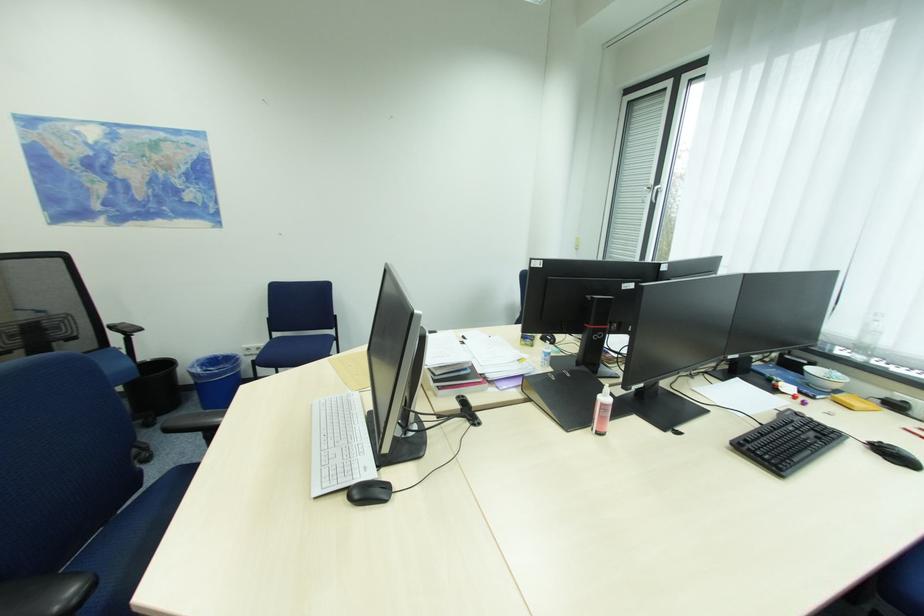
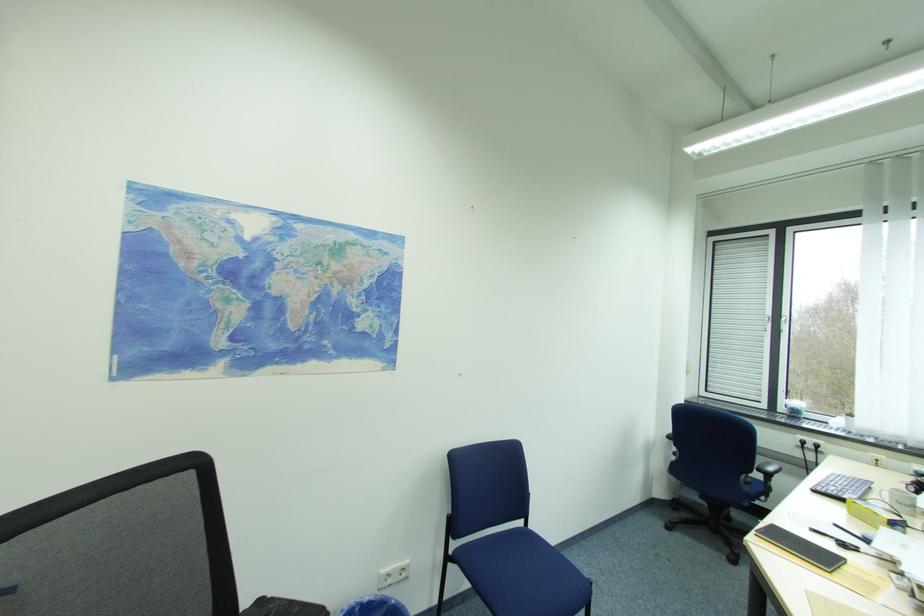
What movement of the cameraman would produce the second image?

The cameraman walked toward left, forward.